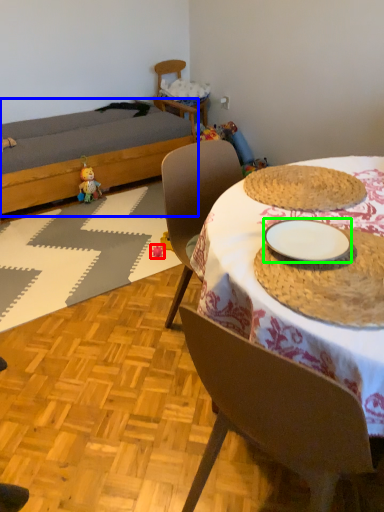
Question: Which object is positioned closest to toy (highlighted by a red box)? Select from bed (highlighted by a blue box) and plate (highlighted by a green box).

Choices:
 (A) bed
 (B) plate

Answer: (A)